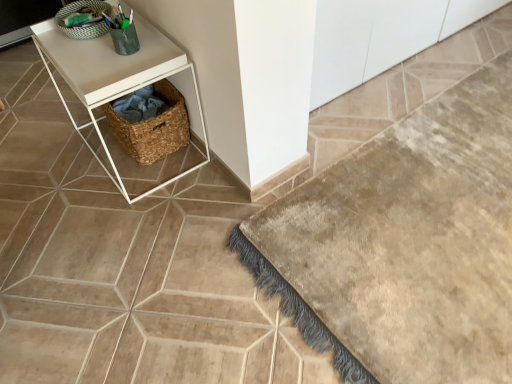
In the scene shown: What is the approximate width of white matte cabinet at upper center?

17.63 inches.

The image size is (512, 384). Describe the element at coordinates (113, 78) in the screenshot. I see `white matte side table at upper left` at that location.

In the scene shown: What is the approximate width of white matte side table at upper left?

The width of white matte side table at upper left is 41.32 centimeters.

Identify the location of woven brown basket at center, which is counted as the 1th basket, starting from the bottom. This screenshot has width=512, height=384. (153, 127).

Describe the element at coordinates (84, 25) in the screenshot. I see `green woven basket at upper left, the 2th basket from the bottom` at that location.

The height and width of the screenshot is (384, 512). What do you see at coordinates (140, 105) in the screenshot?
I see `woven basket at lower left` at bounding box center [140, 105].

Locate an element on the screen. The width and height of the screenshot is (512, 384). beige plush bath mat at lower right is located at coordinates (404, 245).

Considering the positions of objects white matte side table at upper left and green woven basket at upper left, positioned as the 1th basket in top-to-bottom order, in the image provided, who is behind, white matte side table at upper left or green woven basket at upper left, positioned as the 1th basket in top-to-bottom order,?

green woven basket at upper left, positioned as the 1th basket in top-to-bottom order.

Could you measure the distance between white matte side table at upper left and green woven basket at upper left, the 2th basket from the bottom?

A distance of 9.42 inches exists between white matte side table at upper left and green woven basket at upper left, the 2th basket from the bottom.

Does white matte side table at upper left have a smaller size compared to green woven basket at upper left, positioned as the 1th basket in top-to-bottom order?

Actually, white matte side table at upper left might be larger than green woven basket at upper left, positioned as the 1th basket in top-to-bottom order.

Can you confirm if white matte side table at upper left is positioned to the right of green woven basket at upper left, the 2th basket from the bottom?

Yes.

Between point (172, 111) and point (433, 13), which one is positioned in front?

The point (172, 111) is closer to the camera.

In the scene shown: Considering the relative sizes of woven brown basket at center, which is counted as the 1th basket, starting from the bottom, and white matte cabinet at upper center in the image provided, is woven brown basket at center, which is counted as the 1th basket, starting from the bottom, thinner than white matte cabinet at upper center?

Indeed, woven brown basket at center, which is counted as the 1th basket, starting from the bottom, has a lesser width compared to white matte cabinet at upper center.

Is woven brown basket at center, which is counted as the 1th basket, starting from the bottom, smaller than white matte cabinet at upper center?

Indeed, woven brown basket at center, which is counted as the 1th basket, starting from the bottom, has a smaller size compared to white matte cabinet at upper center.

Is woven brown basket at center, the second basket viewed from the top, oriented away from white matte cabinet at upper center?

Yes, woven brown basket at center, the second basket viewed from the top, is positioned with its back facing white matte cabinet at upper center.

Which of these two, beige plush bath mat at lower right or woven basket at lower left, is wider?

Wider between the two is beige plush bath mat at lower right.

Considering the positions of points (499, 195) and (113, 106), is point (499, 195) farther from camera compared to point (113, 106)?

No, it is not.

Is beige plush bath mat at lower right facing away from woven basket at lower left?

No, beige plush bath mat at lower right is not facing away from woven basket at lower left.

From a real-world perspective, between green woven basket at upper left, positioned as the 1th basket in top-to-bottom order, and white matte side table at upper left, who is vertically higher?

green woven basket at upper left, positioned as the 1th basket in top-to-bottom order, is physically above.

From the picture: Is green woven basket at upper left, positioned as the 1th basket in top-to-bottom order, oriented towards white matte side table at upper left?

No, green woven basket at upper left, positioned as the 1th basket in top-to-bottom order, is not oriented towards white matte side table at upper left.

Is green woven basket at upper left, the 2th basket from the bottom, beside white matte side table at upper left?

There is a gap between green woven basket at upper left, the 2th basket from the bottom, and white matte side table at upper left.

Does green woven basket at upper left, positioned as the 1th basket in top-to-bottom order, have a lesser width compared to white matte cabinet at upper center?

Indeed, green woven basket at upper left, positioned as the 1th basket in top-to-bottom order, has a lesser width compared to white matte cabinet at upper center.

Would you consider green woven basket at upper left, positioned as the 1th basket in top-to-bottom order, to be distant from white matte cabinet at upper center?

Yes, green woven basket at upper left, positioned as the 1th basket in top-to-bottom order, is far from white matte cabinet at upper center.

From the image's perspective, is green woven basket at upper left, the 2th basket from the bottom, under white matte cabinet at upper center?

Correct, green woven basket at upper left, the 2th basket from the bottom, appears lower than white matte cabinet at upper center in the image.

Is point (167, 113) positioned before point (129, 99)?

Yes, point (167, 113) is in front of point (129, 99).

Do you think woven brown basket at center, which is counted as the 1th basket, starting from the bottom, is within woven basket at lower left, or outside of it?

woven brown basket at center, which is counted as the 1th basket, starting from the bottom, is located beyond the bounds of woven basket at lower left.

From a real-world perspective, is woven brown basket at center, the second basket viewed from the top, positioned above or below woven basket at lower left?

woven brown basket at center, the second basket viewed from the top, is below woven basket at lower left.

Would you say woven brown basket at center, the second basket viewed from the top, is to the left or to the right of woven basket at lower left in the picture?

Based on their positions, woven brown basket at center, the second basket viewed from the top, is located to the right of woven basket at lower left.

Does woven basket at lower left have a smaller size compared to white matte cabinet at upper center?

Yes.

From the image's perspective, which is above, woven basket at lower left or white matte cabinet at upper center?

white matte cabinet at upper center.

Is woven basket at lower left looking in the opposite direction of white matte cabinet at upper center?

Correct, woven basket at lower left is looking away from white matte cabinet at upper center.

Would you say woven basket at lower left is inside or outside white matte cabinet at upper center?

woven basket at lower left is not inside white matte cabinet at upper center, it's outside.

Find the location of a particular element. This screenshot has height=384, width=512. table located in front of the green woven basket at upper left, the 2th basket from the bottom is located at coordinates (113, 78).

Where is `basket below the white matte cabinet at upper center (from a real-world perspective)`? basket below the white matte cabinet at upper center (from a real-world perspective) is located at coordinates (153, 127).

Which object lies nearer to the anchor point green woven basket at upper left, positioned as the 1th basket in top-to-bottom order, white matte cabinet at upper center or woven brown basket at center, which is counted as the 1th basket, starting from the bottom?

woven brown basket at center, which is counted as the 1th basket, starting from the bottom, lies closer to green woven basket at upper left, positioned as the 1th basket in top-to-bottom order, than the other object.

Looking at the image, which one is located further to green woven basket at upper left, the 2th basket from the bottom, beige plush bath mat at lower right or white matte side table at upper left?

Among the two, beige plush bath mat at lower right is located further to green woven basket at upper left, the 2th basket from the bottom.

Looking at the image, which one is located further to white matte side table at upper left, woven brown basket at center, the second basket viewed from the top, or beige plush bath mat at lower right?

Based on the image, beige plush bath mat at lower right appears to be further to white matte side table at upper left.

When comparing their distances from white matte cabinet at upper center, does green woven basket at upper left, positioned as the 1th basket in top-to-bottom order, or woven basket at lower left seem further?

Among the two, green woven basket at upper left, positioned as the 1th basket in top-to-bottom order, is located further to white matte cabinet at upper center.

From the image, which object appears to be nearer to white matte cabinet at upper center, white matte side table at upper left or beige plush bath mat at lower right?

beige plush bath mat at lower right lies closer to white matte cabinet at upper center than the other object.

Which object lies further to the anchor point white matte cabinet at upper center, woven basket at lower left or white matte side table at upper left?

woven basket at lower left lies further to white matte cabinet at upper center than the other object.

From the picture: Looking at the image, which one is located further to woven brown basket at center, which is counted as the 1th basket, starting from the bottom, woven basket at lower left or white matte side table at upper left?

Based on the image, white matte side table at upper left appears to be further to woven brown basket at center, which is counted as the 1th basket, starting from the bottom.

Looking at the image, which one is located closer to beige plush bath mat at lower right, white matte side table at upper left or green woven basket at upper left, positioned as the 1th basket in top-to-bottom order?

white matte side table at upper left lies closer to beige plush bath mat at lower right than the other object.

The height and width of the screenshot is (384, 512). In order to click on material between white matte side table at upper left and beige plush bath mat at lower right in this screenshot , I will do `click(140, 105)`.

Locate an element on the screen. table between green woven basket at upper left, positioned as the 1th basket in top-to-bottom order, and white matte cabinet at upper center is located at coordinates (113, 78).

This screenshot has height=384, width=512. What are the coordinates of `cabinetry between woven brown basket at center, which is counted as the 1th basket, starting from the bottom, and beige plush bath mat at lower right, in the horizontal direction` in the screenshot? It's located at (368, 40).

Image resolution: width=512 pixels, height=384 pixels. Identify the location of cabinetry situated between green woven basket at upper left, positioned as the 1th basket in top-to-bottom order, and beige plush bath mat at lower right from left to right. (368, 40).